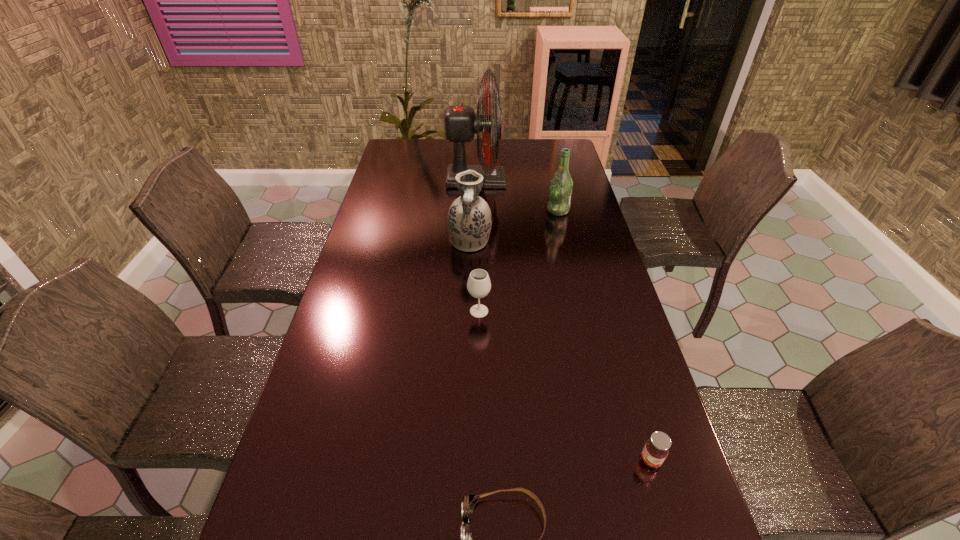
I want to click on free space at the far left corner of the desktop, so click(408, 152).

This screenshot has height=540, width=960. What are the coordinates of `free spot between the fourth nearest object and the second nearest object` in the screenshot? It's located at (561, 352).

This screenshot has height=540, width=960. I want to click on free space between the second nearest object and the fan, so click(x=564, y=320).

I want to click on vacant space in between the wineglass and the beer bottle, so click(x=518, y=261).

Identify which object is the closest to the nearest object. Please provide its 2D coordinates. Your answer should be formatted as a tuple, i.e. [(x, y)], where the tuple contains the x and y coordinates of a point satisfying the conditions above.

[(655, 451)]

Find the location of a particular element. Image resolution: width=960 pixels, height=540 pixels. the third closest object to the shortest object is located at coordinates (469, 219).

Image resolution: width=960 pixels, height=540 pixels. I want to click on vacant space that satisfies the following two spatial constraints: 1. on the front-facing side of the fan; 2. with the handle on the side of the third farthest object, so click(x=475, y=244).

Where is `free point that satisfies the following two spatial constraints: 1. with the handle on the side of the third farthest object; 2. on the right side of the third shortest object`? Image resolution: width=960 pixels, height=540 pixels. free point that satisfies the following two spatial constraints: 1. with the handle on the side of the third farthest object; 2. on the right side of the third shortest object is located at coordinates (468, 311).

Locate an element on the screen. The width and height of the screenshot is (960, 540). free spot that satisfies the following two spatial constraints: 1. on the surface of the second object from right to left; 2. on the front side of the third nearest object is located at coordinates (582, 311).